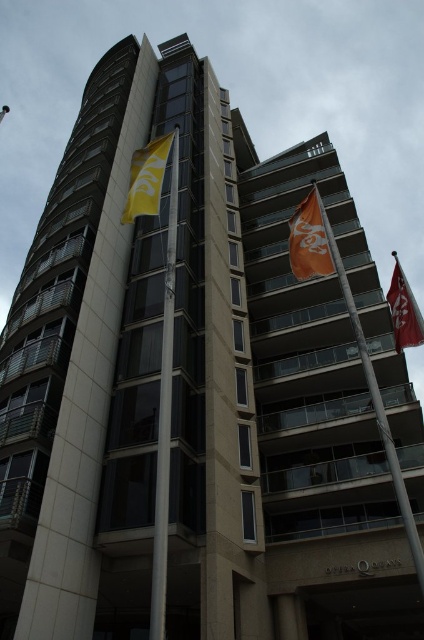
Is point (170, 403) more distant than point (393, 252)?

No, it is not.

You are a GUI agent. You are given a task and a screenshot of the screen. Output one action in this format:
    pyautogui.click(x=<x>, y=<y>)
    Task: Click on the white metallic pole at center
    The image size is (424, 640).
    Given the screenshot: What is the action you would take?
    pyautogui.click(x=164, y=400)

Does yellow fabric flag at upper left come behind red fabric flag at upper right?

No, yellow fabric flag at upper left is closer to the viewer.

Which is behind, point (128, 204) or point (415, 308)?

Positioned behind is point (415, 308).

Locate an element on the screen. This screenshot has height=640, width=424. yellow fabric flag at upper left is located at coordinates (147, 179).

Locate an element on the screen. This screenshot has width=424, height=640. yellow fabric flag at upper left is located at coordinates (147, 179).

Is orange fabric flag at upper center further to the viewer compared to yellow fabric flag at upper left?

Yes.

Is orange fabric flag at upper center positioned before yellow fabric flag at upper left?

That is False.

The image size is (424, 640). What are the coordinates of `orange fabric flag at upper center` in the screenshot? It's located at (312, 240).